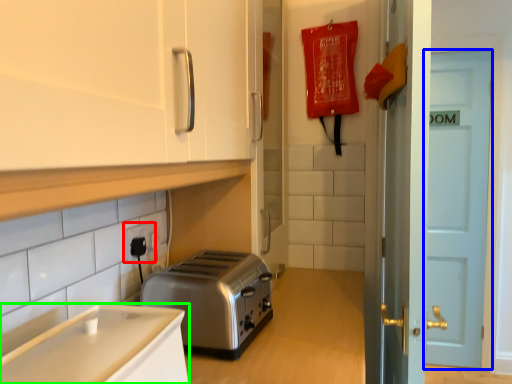
Question: Which object is positioned farthest from electric outlet (highlighted by a red box)? Select from door (highlighted by a blue box) and cabinetry (highlighted by a green box).

Choices:
 (A) door
 (B) cabinetry

Answer: (A)